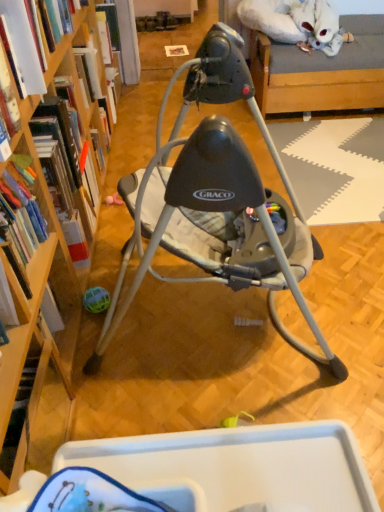
In order to click on vacant region below matte gray baby swing at center (from a real-world perspective) in this screenshot , I will do `click(210, 324)`.